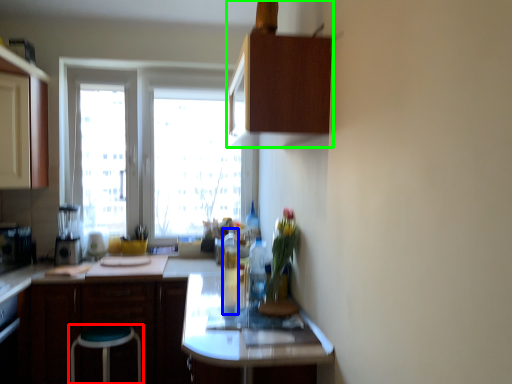
Question: Based on their relative distances, which object is nearer to stool (highlighted by a red box)? Choose from bottle (highlighted by a blue box) and cabinetry (highlighted by a green box).

Choices:
 (A) bottle
 (B) cabinetry

Answer: (A)